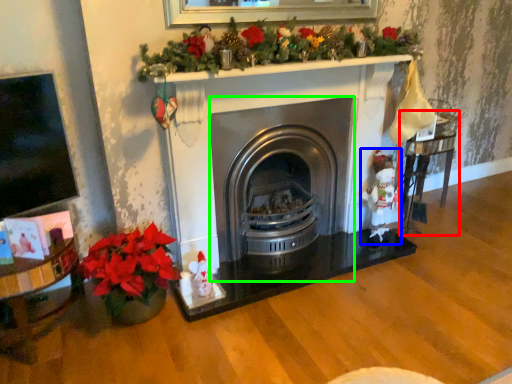
Question: Which is farther away from table (highlighted by a red box)? santa claus (highlighted by a blue box) or wood burning stove (highlighted by a green box)?

Choices:
 (A) santa claus
 (B) wood burning stove

Answer: (B)